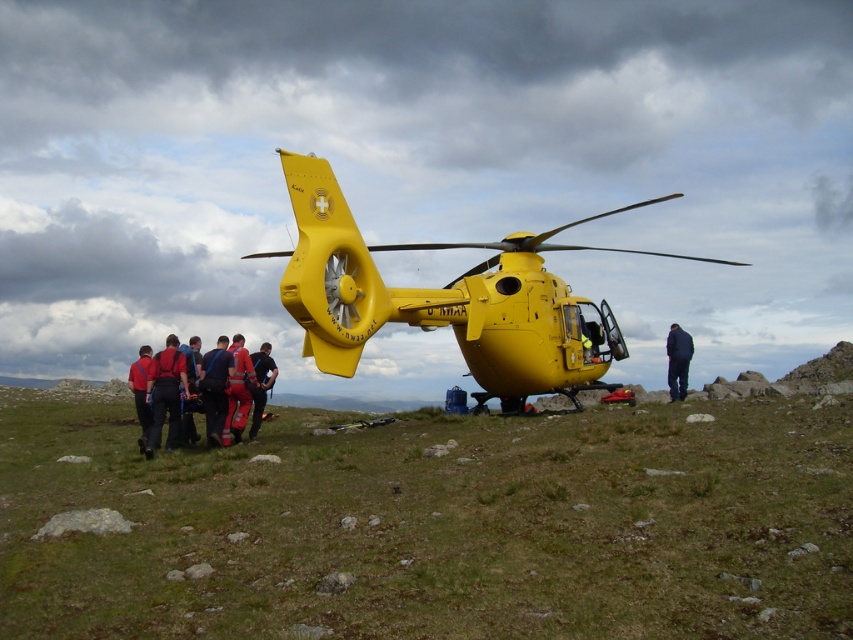
Question: Can you confirm if red reflective jacket at lower left is smaller than red reflective suit at center?

Choices:
 (A) no
 (B) yes

Answer: (A)

Question: Among these points, which one is farthest from the camera?

Choices:
 (A) (223, 422)
 (B) (247, 396)

Answer: (B)

Question: Does red fabric backpack at lower left appear over red reflective suit at center?

Choices:
 (A) no
 (B) yes

Answer: (A)

Question: Considering the real-world distances, which object is farthest from the red fabric pants at center?

Choices:
 (A) red reflective suit at center
 (B) red reflective jacket at lower left
 (C) red fabric backpack at lower left
 (D) red fabric jacket at left

Answer: (D)

Question: Can you confirm if red fabric backpack at lower left is positioned to the right of red reflective jacket at center?

Choices:
 (A) yes
 (B) no

Answer: (B)

Question: Which point is closer to the camera?

Choices:
 (A) (248, 394)
 (B) (677, 380)
 (C) (256, 364)
 (D) (242, 385)

Answer: (D)